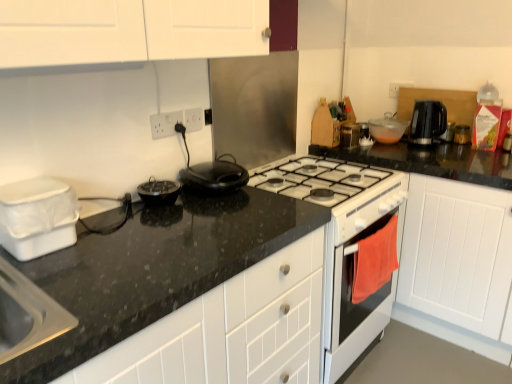
The width and height of the screenshot is (512, 384). I want to click on vacant space in front of white plastic container at left, the 7th kitchen appliance from the back, so click(42, 283).